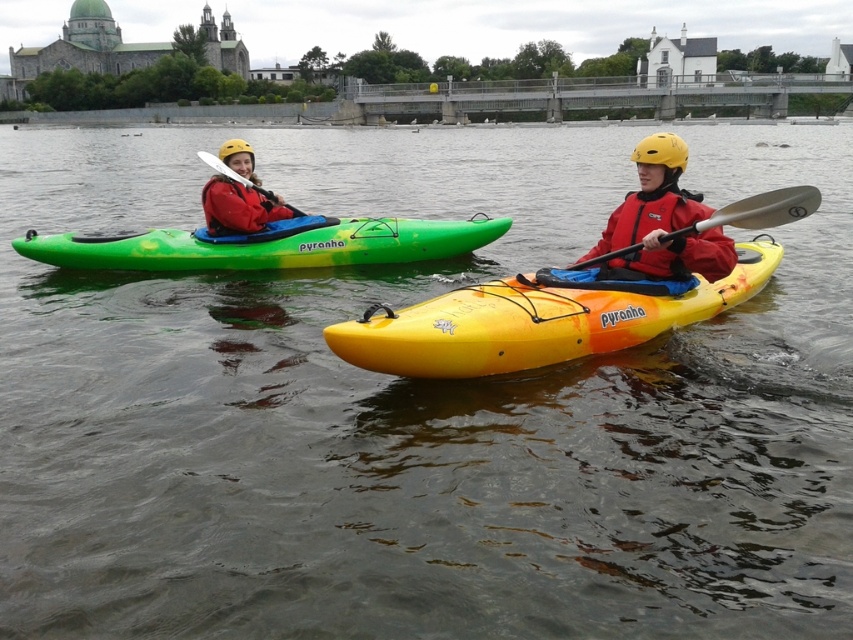
Does yellow matte kayak at center have a lesser width compared to matte red jacket at center?

In fact, yellow matte kayak at center might be wider than matte red jacket at center.

Who is more forward, (500, 333) or (630, 221)?

Point (500, 333) is more forward.

Identify the location of yellow matte kayak at center. (538, 317).

Between green matte kayak at left and matte red jacket at center, which one has more height?

green matte kayak at left is taller.

Who is positioned more to the left, green matte kayak at left or matte red jacket at center?

From the viewer's perspective, green matte kayak at left appears more on the left side.

Find the location of `green matte kayak at left`. green matte kayak at left is located at coordinates (265, 244).

Does matte red jacket at center appear on the left side of matte red jacket at left?

In fact, matte red jacket at center is to the right of matte red jacket at left.

Which is below, matte red jacket at center or matte red jacket at left?

matte red jacket at center

Measure the distance between point (x=724, y=262) and camera.

Point (x=724, y=262) and camera are 8.27 meters apart.

This screenshot has width=853, height=640. Find the location of `matte red jacket at center`. matte red jacket at center is located at coordinates (662, 221).